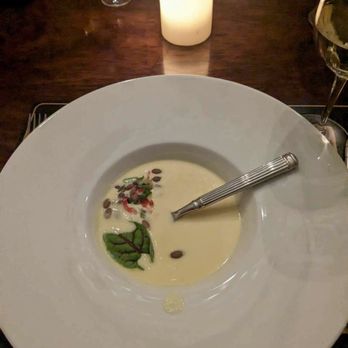
This screenshot has width=348, height=348. I want to click on bowl, so click(15, 222).